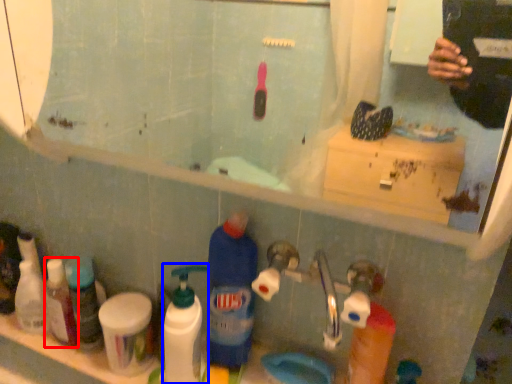
Question: Which of the following is the farthest to the observer, toiletry (highlighted by a red box) or cleaning product (highlighted by a blue box)?

Choices:
 (A) toiletry
 (B) cleaning product

Answer: (A)